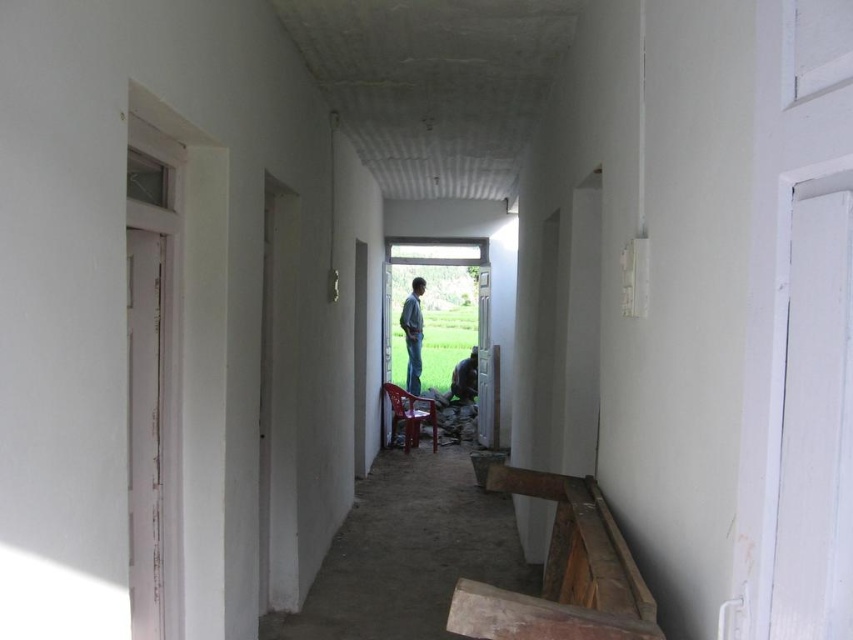
Question: Observing the image, what is the correct spatial positioning of plastic chair at center in reference to blue denim jeans at center?

Choices:
 (A) below
 (B) above

Answer: (A)

Question: Does blue denim jeans at center have a lesser width compared to dark brown leather jacket at center?

Choices:
 (A) no
 (B) yes

Answer: (B)

Question: Is plastic chair at center positioned behind blue denim jeans at center?

Choices:
 (A) yes
 (B) no

Answer: (B)

Question: Considering the real-world distances, which object is closest to the plastic chair at center?

Choices:
 (A) blue denim jeans at center
 (B) dark brown leather jacket at center

Answer: (A)

Question: Which point is closer to the camera?

Choices:
 (A) blue denim jeans at center
 (B) plastic chair at center

Answer: (B)

Question: Which object is closer to the camera taking this photo?

Choices:
 (A) dark brown leather jacket at center
 (B) blue denim jeans at center

Answer: (B)